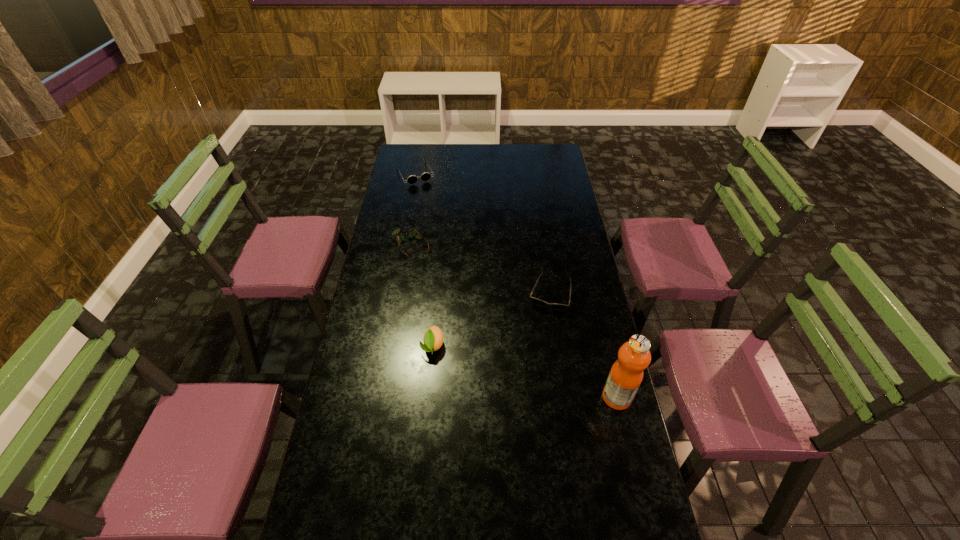
The width and height of the screenshot is (960, 540). What are the coordinates of `vacant region located on the left of the fruit juice` in the screenshot? It's located at (574, 397).

The height and width of the screenshot is (540, 960). Identify the location of vacant space located on the front-facing side of the second farthest object. (446, 296).

Locate an element on the screen. The image size is (960, 540). free spot located 0.300m on the front-facing side of the second farthest object is located at coordinates (453, 305).

At what (x,y) coordinates should I click in order to perform the action: click on blank space located 0.150m on the front-facing side of the second farthest object. Please return your answer as a coordinate pair (x, y). Image resolution: width=960 pixels, height=540 pixels. Looking at the image, I should click on (435, 280).

Locate an element on the screen. This screenshot has width=960, height=540. free space located 0.110m on the front-facing side of the farther sunglasses is located at coordinates (427, 198).

Locate an element on the screen. vacant area located on the front-facing side of the farther sunglasses is located at coordinates (424, 192).

Image resolution: width=960 pixels, height=540 pixels. What are the coordinates of `free space located 0.270m on the front-facing side of the farther sunglasses` in the screenshot? It's located at (437, 217).

You are a GUI agent. You are given a task and a screenshot of the screen. Output one action in this format:
    pyautogui.click(x=<x>, y=<y>)
    Task: Click on the vacant space located on the front-facing side of the third nearest object
    The width and height of the screenshot is (960, 540).
    Given the screenshot: What is the action you would take?
    pyautogui.click(x=521, y=401)

I want to click on free space located 0.290m on the front-facing side of the third nearest object, so click(528, 377).

Locate an element on the screen. vacant space located on the front-facing side of the third nearest object is located at coordinates (525, 388).